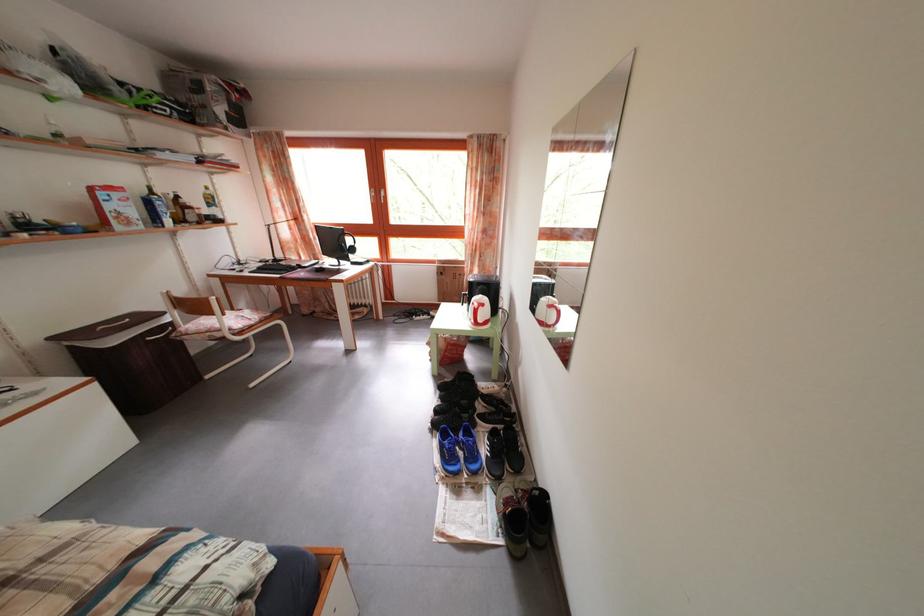
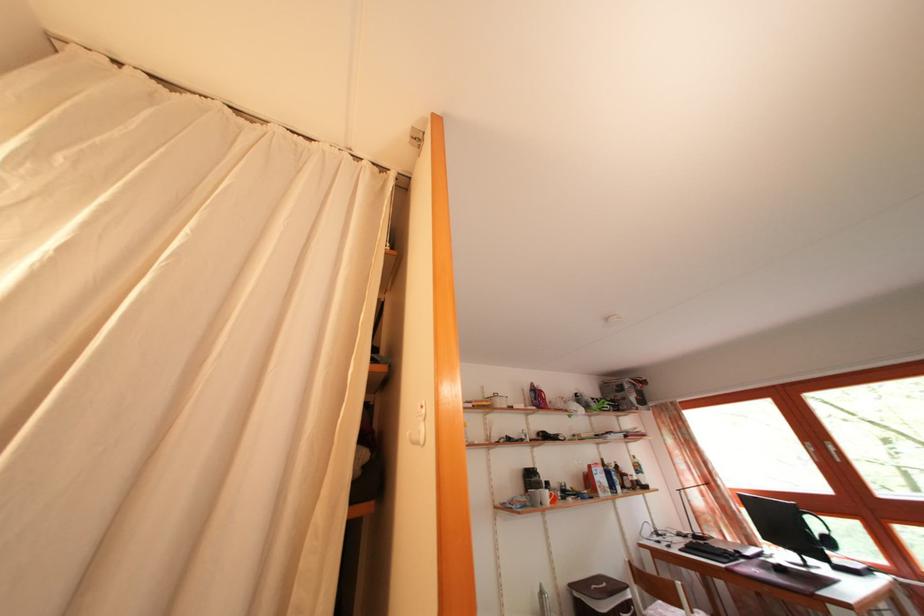
In the second image, find the point that corresponds to point 360,257 in the first image.

(837, 549)